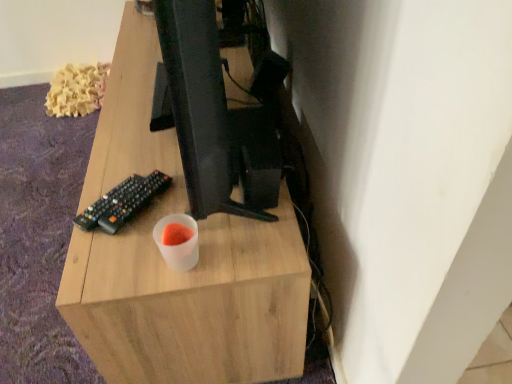
Question: Is black plastic remote control at lower left at the left side of light wood desk at center?

Choices:
 (A) yes
 (B) no

Answer: (A)

Question: From the image's perspective, is black plastic remote control at lower left above light wood desk at center?

Choices:
 (A) no
 (B) yes

Answer: (A)

Question: Would you say black plastic remote control at lower left is outside light wood desk at center?

Choices:
 (A) yes
 (B) no

Answer: (A)

Question: Considering the relative positions of black plastic remote control at lower left and light wood desk at center in the image provided, is black plastic remote control at lower left to the right of light wood desk at center from the viewer's perspective?

Choices:
 (A) no
 (B) yes

Answer: (A)

Question: Is black plastic remote control at lower left facing towards light wood desk at center?

Choices:
 (A) yes
 (B) no

Answer: (B)

Question: Is black plastic remote control at lower left positioned before light wood desk at center?

Choices:
 (A) yes
 (B) no

Answer: (B)

Question: From the image's perspective, would you say light wood desk at center is positioned over black plastic remote control at lower left?

Choices:
 (A) yes
 (B) no

Answer: (A)

Question: Is light wood desk at center shorter than black plastic remote control at lower left?

Choices:
 (A) yes
 (B) no

Answer: (B)

Question: Is light wood desk at center further to camera compared to black plastic remote control at lower left?

Choices:
 (A) no
 (B) yes

Answer: (A)

Question: Can you confirm if light wood desk at center is thinner than black plastic remote control at lower left?

Choices:
 (A) no
 (B) yes

Answer: (A)

Question: Considering the relative positions of light wood desk at center and black plastic remote control at lower left in the image provided, is light wood desk at center to the right of black plastic remote control at lower left from the viewer's perspective?

Choices:
 (A) yes
 (B) no

Answer: (A)

Question: From the image's perspective, is light wood desk at center beneath black plastic remote control at lower left?

Choices:
 (A) yes
 (B) no

Answer: (B)

Question: Is light wood desk at center wider or thinner than black plastic remote control at lower left?

Choices:
 (A) thin
 (B) wide

Answer: (B)